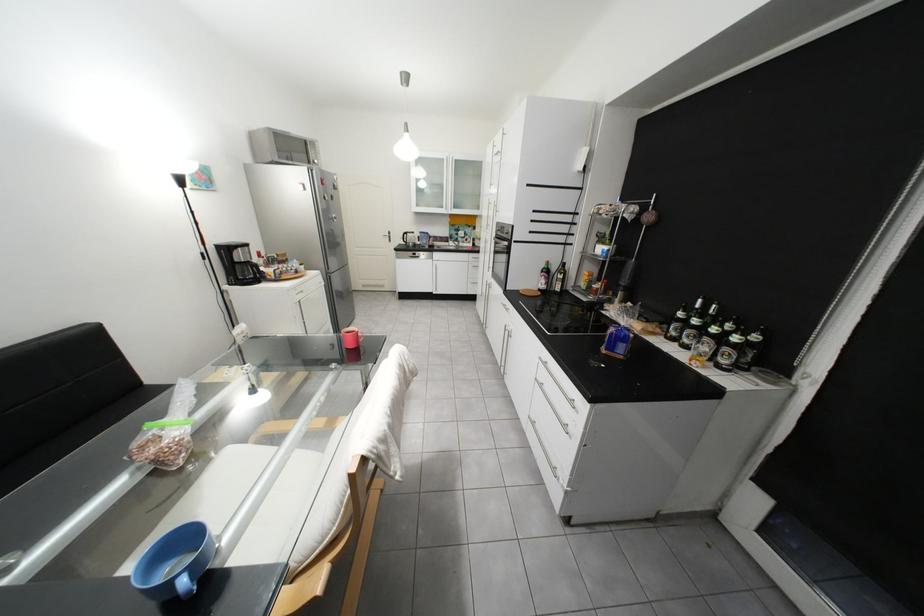
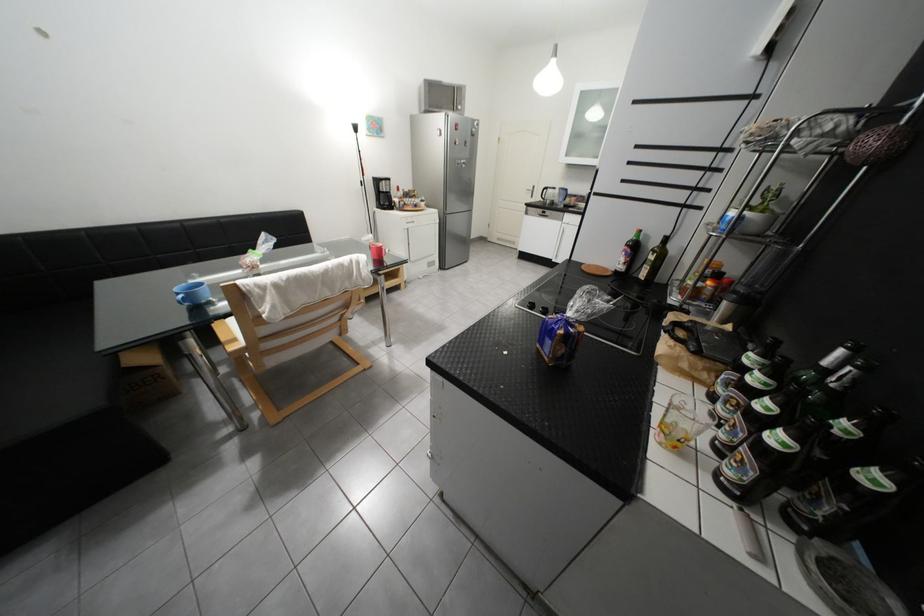
Where in the second image is the point corresponding to (249,268) from the first image?

(393, 196)